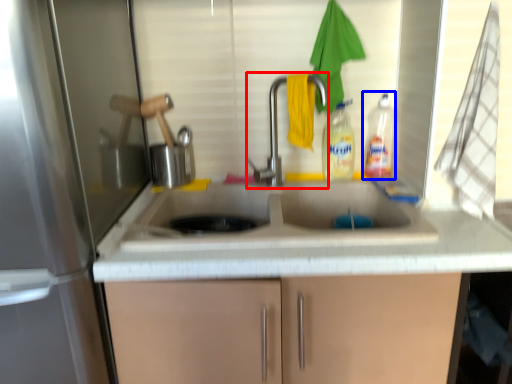
Question: Which of the following is the farthest to the observer, tap (highlighted by a red box) or bottle (highlighted by a blue box)?

Choices:
 (A) tap
 (B) bottle

Answer: (B)